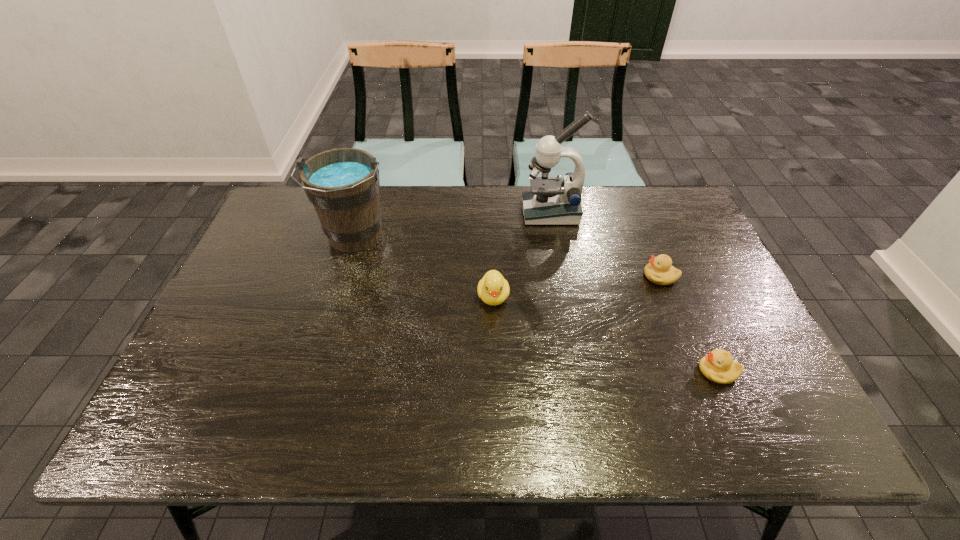
Find the location of a particular element. vacant space situated at the face of the nearest duckling is located at coordinates (616, 371).

The image size is (960, 540). In order to click on free space located 0.340m at the face of the nearest duckling in this screenshot , I will do `click(552, 371)`.

Where is `blank area located at the face of the nearest duckling`? blank area located at the face of the nearest duckling is located at coordinates (552, 371).

Where is `microscope that is at the far edge`? microscope that is at the far edge is located at coordinates (552, 201).

Where is `wine bucket that is at the far edge`? The height and width of the screenshot is (540, 960). wine bucket that is at the far edge is located at coordinates (343, 184).

In the image, there is a desktop. Identify the location of blank space at the far edge. (479, 189).

Find the location of a particular element. free space at the left edge of the desktop is located at coordinates (238, 360).

Identify the location of vacant region at the right edge of the desktop. This screenshot has width=960, height=540. (692, 270).

This screenshot has height=540, width=960. I want to click on free spot at the far left corner of the desktop, so click(x=315, y=222).

Where is `vacant space at the near left corner of the desktop`? The height and width of the screenshot is (540, 960). vacant space at the near left corner of the desktop is located at coordinates (202, 428).